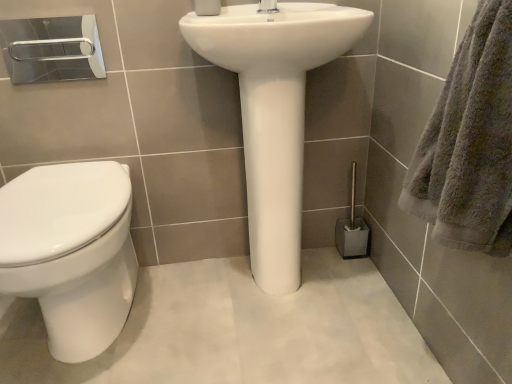
Where is `free point to the right of white glossy toilet at left`? free point to the right of white glossy toilet at left is located at coordinates (205, 325).